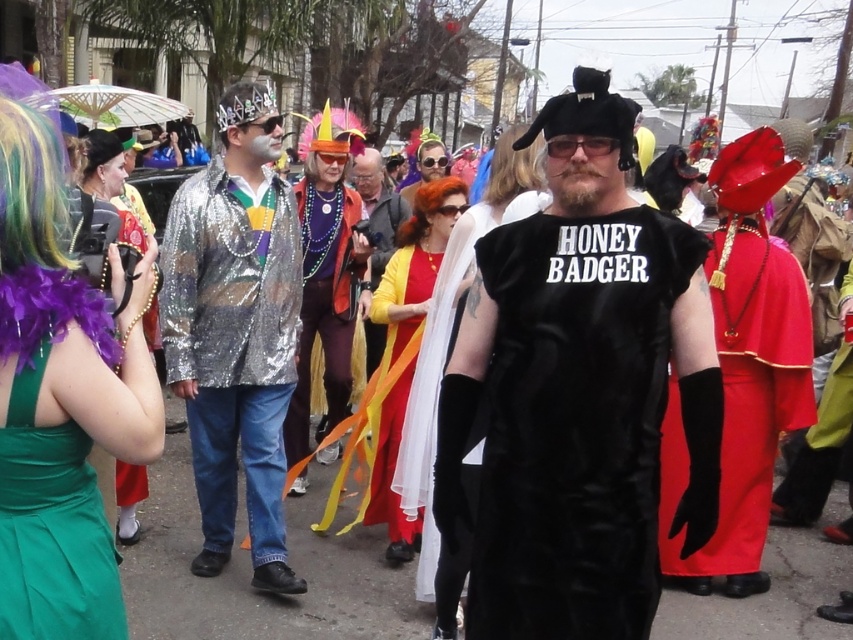
You are a photographer at the center of the scene and want to capture both the velvet black vest at center and the yellow satin dress at center in a single frame. Which one should you adjust your camera angle to focus on first to ensure both are in the frame?

The velvet black vest at center is positioned on the right side of yellow satin dress at center, so you should focus on the yellow satin dress at center first to ensure both are included in the frame.

You are a photographer at the festival and want to capture the person in the center wearing the velvet black vest at center and the red synthetic wig at center. To ensure both items are visible, where should you position the camera relative to the person?

Position the camera so that it can capture the red synthetic wig at center above the velvet black vest at center, as the velvet black vest at center is located below the red synthetic wig at center.

You are a photographer trying to capture both the velvet black vest at center and the yellow satin dress at center in a single frame. Based on their sizes, which object should you focus on to ensure both are fully visible without cropping?

The velvet black vest at center is wider than the yellow satin dress at center, so focusing on the center where both overlap would ensure both are fully visible.